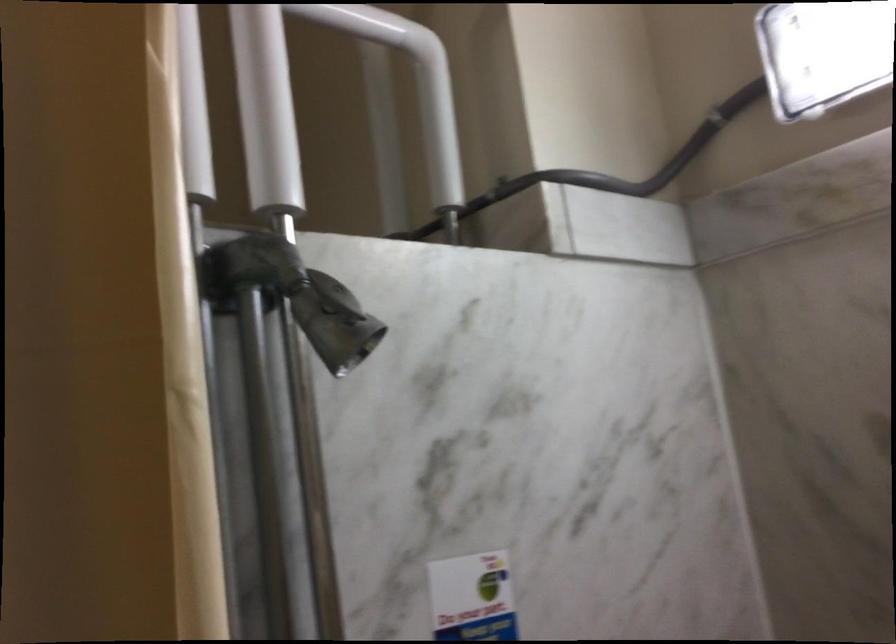
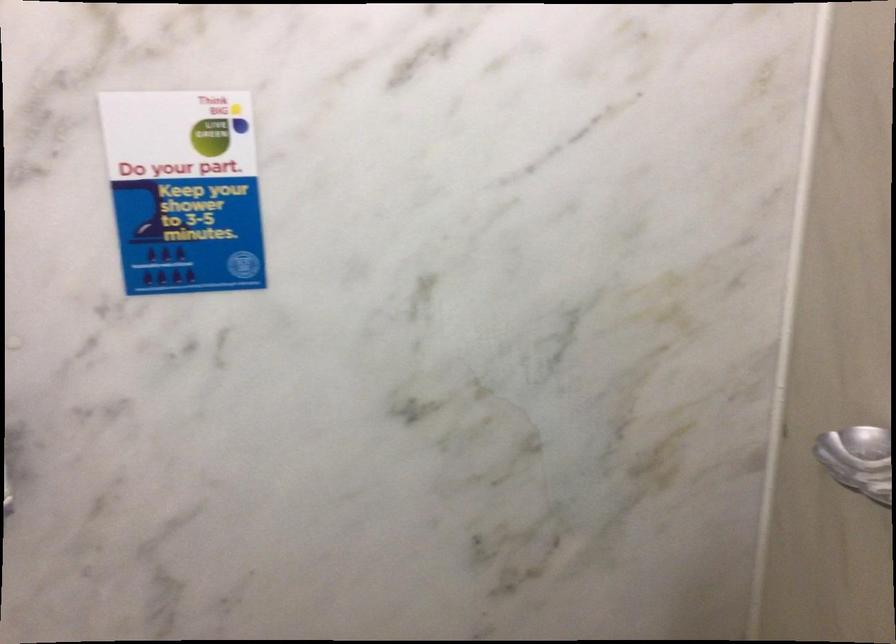
Question: The images are taken continuously from a first-person perspective. In which direction are you moving?

Choices:
 (A) Left
 (B) Right
 (C) Forward
 (D) Backward

Answer: (D)